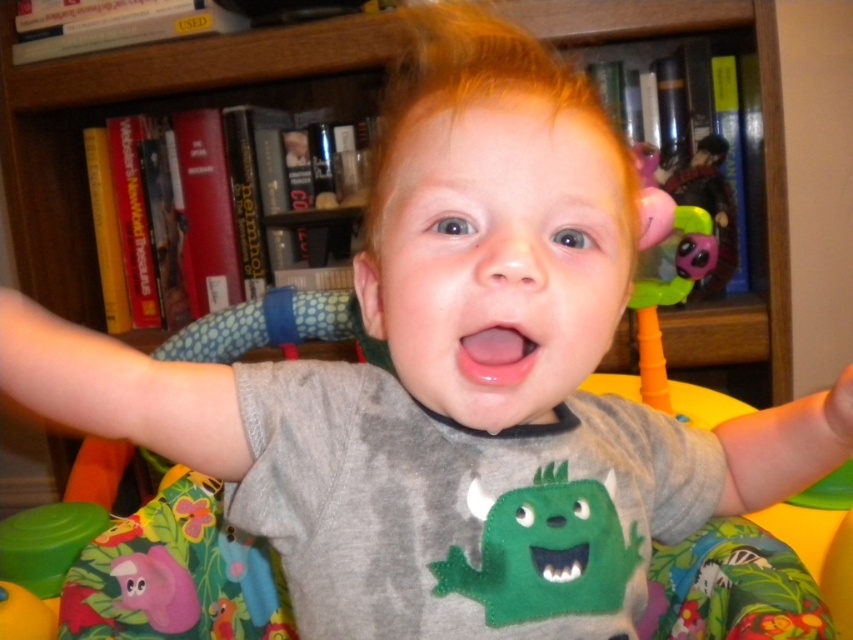
You are a parent looking at the baby activity center. There is a point marked at coordinates (544, 550). What object is located at this point?

The point at coordinates (544, 550) corresponds to the green felt monster at center.

You are a parent trying to find a book on the wooden bookshelf at upper center while keeping an eye on your child. Can you see the translucent plastic toy at upper right from where you are looking at the bookshelf?

The wooden bookshelf at upper center is positioned over the translucent plastic toy at upper right, so yes, you can see the translucent plastic toy at upper right behind the bookshelf.

You are a parent trying to clean the baby activity center. You notice the green felt monster at center and the pink glossy mouth at center. Which object is closer to you so you can reach it first?

The green felt monster at center is closer to you than the pink glossy mouth at center, so you can reach it first.